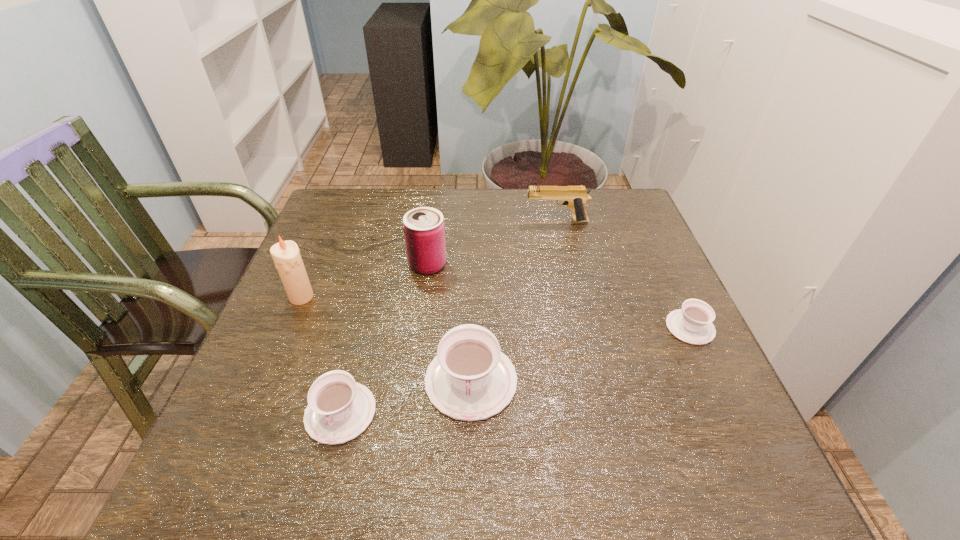
Locate an element on the screen. The image size is (960, 540). the tallest object is located at coordinates (286, 255).

The image size is (960, 540). I want to click on the third farthest object, so click(286, 255).

At what (x,y) coordinates should I click in order to perform the action: click on free space located on the handle side of the shortest teacup. Please return your answer as a coordinate pair (x, y). Looking at the image, I should click on (650, 241).

The width and height of the screenshot is (960, 540). I want to click on blank space located 0.240m on the handle side of the shortest teacup, so point(651,244).

The image size is (960, 540). Identify the location of free spot located on the handle side of the shortest teacup. (660, 264).

Find the location of a particular element. The height and width of the screenshot is (540, 960). vacant area situated 0.320m on the front of the can is located at coordinates (411, 392).

At what (x,y) coordinates should I click in order to perform the action: click on vacant space located at the barrel of the fourth shortest object. Please return your answer as a coordinate pair (x, y). This screenshot has height=540, width=960. Looking at the image, I should click on (490, 221).

I want to click on vacant space situated 0.130m at the barrel of the fourth shortest object, so click(478, 221).

I want to click on free spot located 0.320m at the barrel of the fourth shortest object, so click(x=410, y=221).

This screenshot has width=960, height=540. Identify the location of vacant space located 0.350m on the right of the third farthest object. (468, 297).